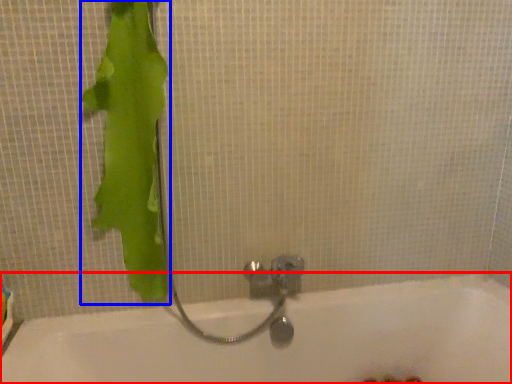
Question: Which object appears farthest to the camera in this image, bathtub (highlighted by a red box) or animal (highlighted by a blue box)?

Choices:
 (A) bathtub
 (B) animal

Answer: (B)